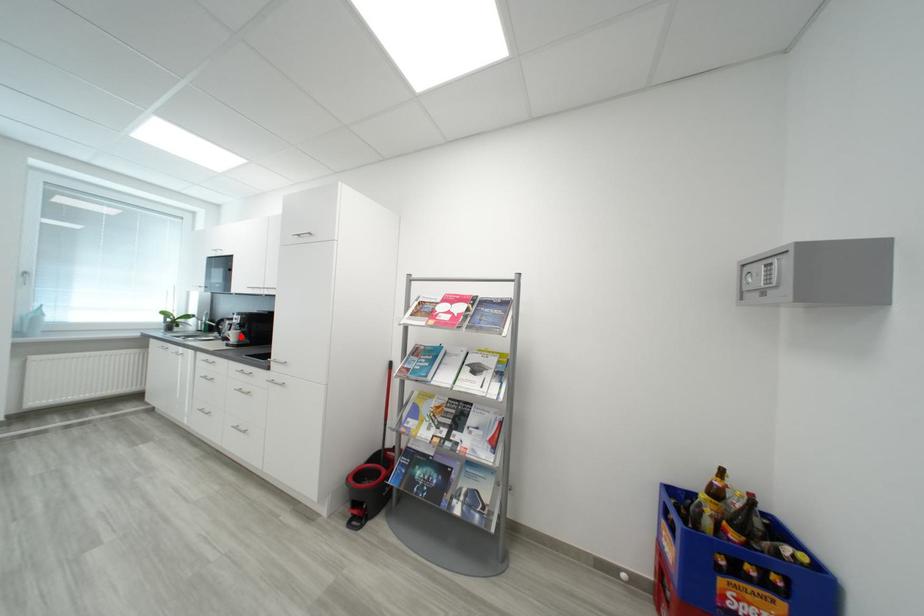
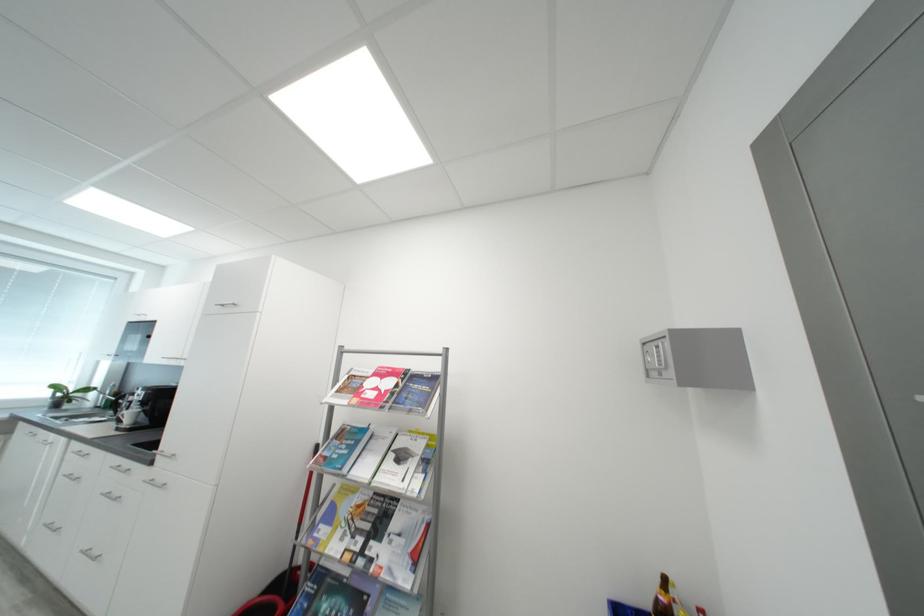
Question: I am providing you with two images of the same scene from different viewpoints. A red point is shown in image1. For the corresponding object point in image2, is it positioned nearer or farther from the camera?

Choices:
 (A) Nearer
 (B) Farther

Answer: (A)